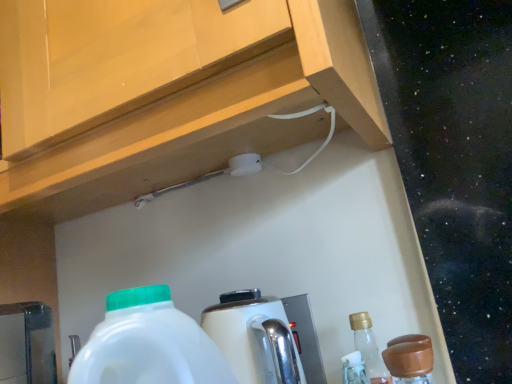
Question: Would you say brown matte bottle at lower right is to the left or to the right of white glossy coffee machine at center in the picture?

Choices:
 (A) right
 (B) left

Answer: (A)

Question: In terms of height, does brown matte bottle at lower right look taller or shorter compared to white glossy coffee machine at center?

Choices:
 (A) short
 (B) tall

Answer: (A)

Question: Is brown matte bottle at lower right in front of or behind white glossy coffee machine at center in the image?

Choices:
 (A) behind
 (B) front

Answer: (B)

Question: Considering the positions of white glossy coffee machine at center and brown matte bottle at lower right in the image, is white glossy coffee machine at center wider or thinner than brown matte bottle at lower right?

Choices:
 (A) thin
 (B) wide

Answer: (B)

Question: Considering the positions of point (278, 362) and point (396, 367), is point (278, 362) closer or farther from the camera than point (396, 367)?

Choices:
 (A) farther
 (B) closer

Answer: (A)

Question: From the image's perspective, relative to brown matte bottle at lower right, is white glossy coffee machine at center above or below?

Choices:
 (A) above
 (B) below

Answer: (A)

Question: Is white glossy coffee machine at center spatially inside brown matte bottle at lower right, or outside of it?

Choices:
 (A) inside
 (B) outside

Answer: (B)